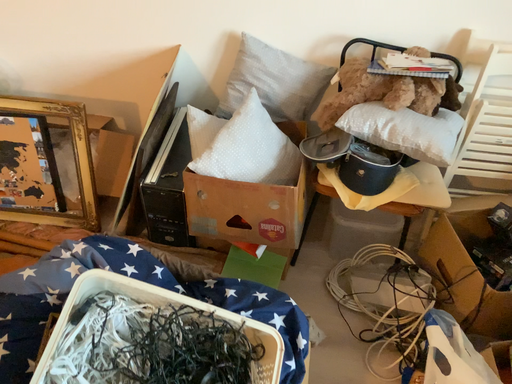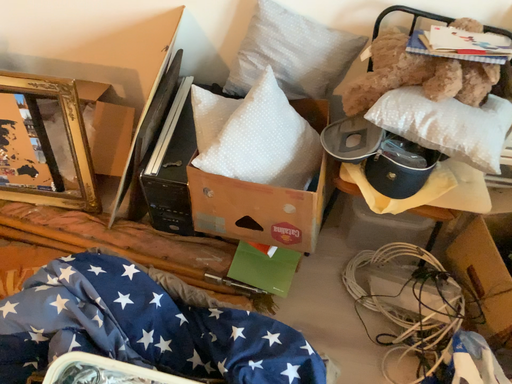
Question: Which way did the camera rotate in the video?

Choices:
 (A) rotated upward
 (B) rotated downward

Answer: (B)